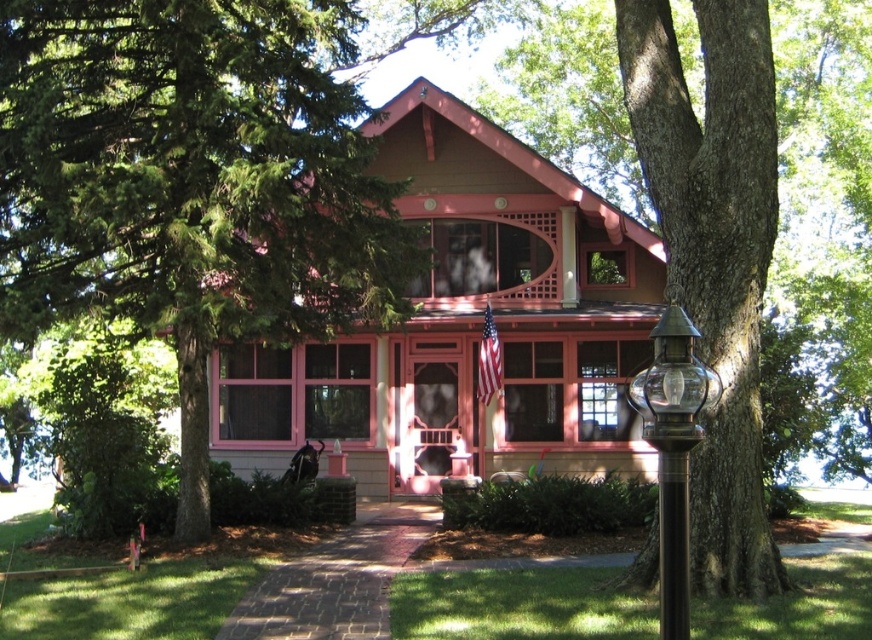
Can you confirm if smooth brown tree trunk at right is wider than bronze metallic lamp post at right?

No, smooth brown tree trunk at right is not wider than bronze metallic lamp post at right.

Is point (665, 236) closer to camera compared to point (652, 385)?

No, (665, 236) is further to viewer.

Where is `smooth brown tree trunk at right`? smooth brown tree trunk at right is located at coordinates (714, 253).

Can you confirm if green leafy tree at left is positioned to the right of smooth brown tree trunk at right?

In fact, green leafy tree at left is to the left of smooth brown tree trunk at right.

Identify the location of green leafy tree at left. (191, 182).

Is point (303, 1) farther from viewer compared to point (645, 38)?

Yes, point (303, 1) is behind point (645, 38).

Where is `green leafy tree at left`? This screenshot has height=640, width=872. green leafy tree at left is located at coordinates (191, 182).

Locate an element on the screen. The image size is (872, 640). green leafy tree at left is located at coordinates (191, 182).

Can you confirm if green leafy tree at left is positioned to the right of bronze metallic lamp post at right?

Incorrect, green leafy tree at left is not on the right side of bronze metallic lamp post at right.

You are a GUI agent. You are given a task and a screenshot of the screen. Output one action in this format:
    pyautogui.click(x=<x>, y=<y>)
    Task: Click on the green leafy tree at left
    The image size is (872, 640).
    Given the screenshot: What is the action you would take?
    pyautogui.click(x=191, y=182)